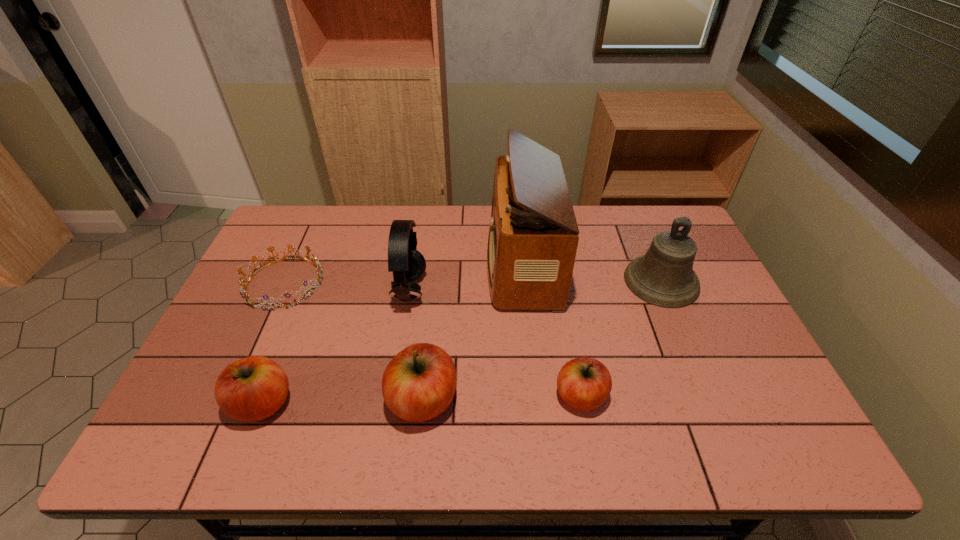
Locate an element on the screen. The height and width of the screenshot is (540, 960). vacant space positioned 0.360m on the right of the second apple from right to left is located at coordinates (609, 400).

What are the coordinates of `vacant position located on the right of the rightmost apple` in the screenshot? It's located at (694, 396).

You are a GUI agent. You are given a task and a screenshot of the screen. Output one action in this format:
    pyautogui.click(x=<x>, y=<y>)
    Task: Click on the vacant space located on the front panel of the tallest object
    The image size is (960, 540).
    Given the screenshot: What is the action you would take?
    pyautogui.click(x=379, y=264)

You are a GUI agent. You are given a task and a screenshot of the screen. Output one action in this format:
    pyautogui.click(x=<x>, y=<y>)
    Task: Click on the vacant space situated on the front panel of the tallest object
    The width and height of the screenshot is (960, 540).
    Given the screenshot: What is the action you would take?
    pyautogui.click(x=440, y=264)

Where is `blank area located 0.390m on the front panel of the tallest object`? This screenshot has height=540, width=960. blank area located 0.390m on the front panel of the tallest object is located at coordinates (364, 264).

Where is `free space located on the ear cups of the earphone`? This screenshot has height=540, width=960. free space located on the ear cups of the earphone is located at coordinates (507, 292).

This screenshot has height=540, width=960. I want to click on vacant space located 0.150m on the front-facing side of the shortest object, so click(x=373, y=283).

What are the coordinates of `vacant space located on the left of the rightmost object` in the screenshot? It's located at (549, 281).

Where is `object present at the far edge`? object present at the far edge is located at coordinates (533, 237).

Where is `apple that is at the left edge`? This screenshot has height=540, width=960. apple that is at the left edge is located at coordinates (253, 388).